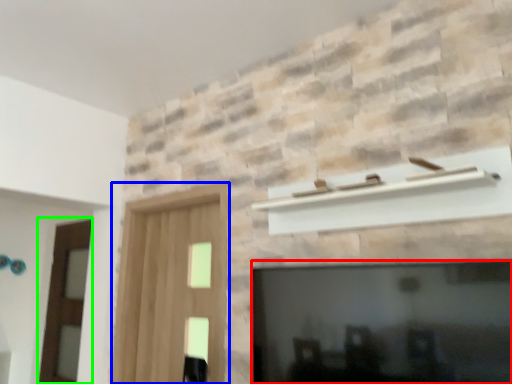
Question: Which object is the closest to the fireplace (highlighted by a red box)? Choose among these: screen door (highlighted by a blue box) or screen door (highlighted by a green box).

Choices:
 (A) screen door
 (B) screen door

Answer: (A)